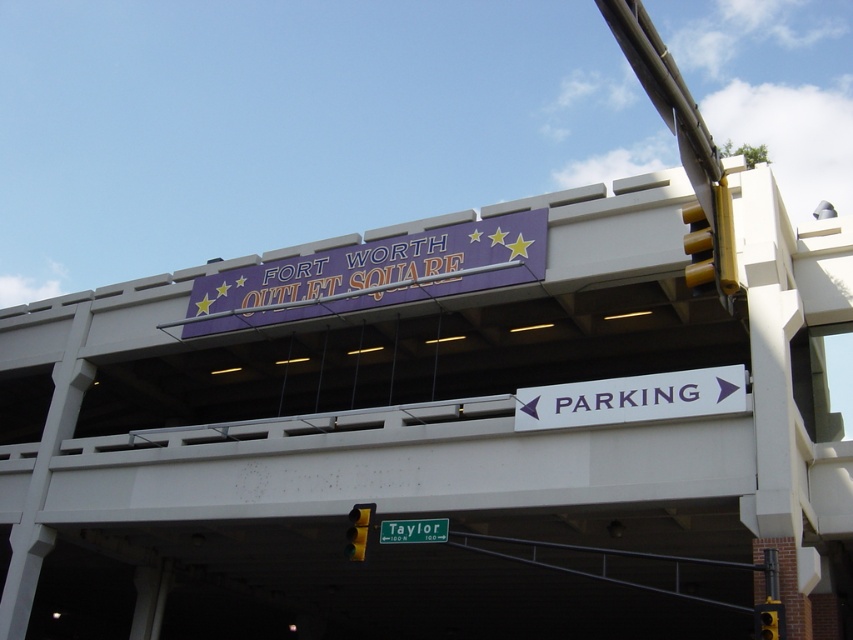
Is purple glossy sign at upper center further to camera compared to yellow plastic traffic light at upper right?

Yes, it is.

Is purple glossy sign at upper center taller than yellow plastic traffic light at upper right?

Indeed, purple glossy sign at upper center has a greater height compared to yellow plastic traffic light at upper right.

Where is `purple glossy sign at upper center`? The width and height of the screenshot is (853, 640). purple glossy sign at upper center is located at coordinates (372, 275).

Between white plastic parking sign at lower center and yellow plastic traffic light at upper right, which one is positioned higher?

white plastic parking sign at lower center is higher up.

Is white plastic parking sign at lower center below yellow plastic traffic light at upper right?

Incorrect, white plastic parking sign at lower center is not positioned below yellow plastic traffic light at upper right.

Who is more distant from viewer, (698, 396) or (764, 618)?

The point (698, 396) is more distant.

Identify the location of white plastic parking sign at lower center. The width and height of the screenshot is (853, 640). (631, 397).

Between purple glossy sign at upper center and green metallic street sign at lower center, which one has less height?

green metallic street sign at lower center

Which is behind, point (227, 289) or point (415, 538)?

The point (227, 289) is more distant.

Who is more forward, (399, 237) or (396, 522)?

Point (396, 522) is in front.

The height and width of the screenshot is (640, 853). Find the location of `purple glossy sign at upper center`. purple glossy sign at upper center is located at coordinates (372, 275).